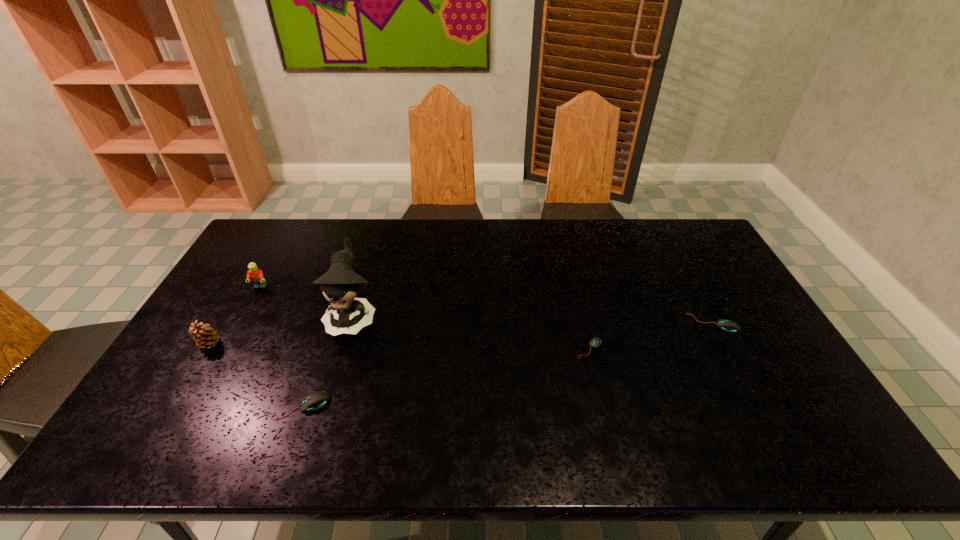
Where is `vacant area at the near edge`? vacant area at the near edge is located at coordinates (628, 412).

Where is `vacant space at the left edge of the desktop`? The height and width of the screenshot is (540, 960). vacant space at the left edge of the desktop is located at coordinates (239, 281).

Locate an element on the screen. free space at the right edge is located at coordinates (712, 274).

In the image, there is a desktop. Identify the location of free region at the far left corner. This screenshot has height=540, width=960. (251, 248).

What are the coordinates of `free space at the far right corner of the desktop` in the screenshot? It's located at (677, 226).

At what (x,y) coordinates should I click in order to perform the action: click on free space between the tallest object and the pinecone. Please return your answer as a coordinate pair (x, y). Looking at the image, I should click on (281, 330).

This screenshot has height=540, width=960. I want to click on unoccupied area between the nearest mouse and the shortest mouse, so click(443, 377).

Find the location of a particular element. The width and height of the screenshot is (960, 540). empty space that is in between the farthest object and the nearest object is located at coordinates (277, 346).

You are a GUI agent. You are given a task and a screenshot of the screen. Output one action in this format:
    pyautogui.click(x=<x>, y=<y>)
    Task: Click on the free space between the Lego and the second nearest mouse
    
    Given the screenshot: What is the action you would take?
    pyautogui.click(x=425, y=317)

Where is `vacant point located between the second object from right to left and the doll`? Image resolution: width=960 pixels, height=540 pixels. vacant point located between the second object from right to left and the doll is located at coordinates (471, 332).